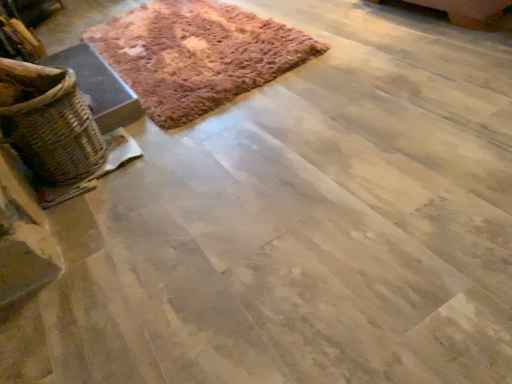
Question: Is the depth of woven brown basket at left less than that of brown textured rug at upper left?

Choices:
 (A) yes
 (B) no

Answer: (A)

Question: Is woven brown basket at left oriented away from brown textured rug at upper left?

Choices:
 (A) yes
 (B) no

Answer: (B)

Question: Considering the relative sizes of woven brown basket at left and brown textured rug at upper left in the image provided, is woven brown basket at left bigger than brown textured rug at upper left?

Choices:
 (A) yes
 (B) no

Answer: (B)

Question: Can you confirm if woven brown basket at left is positioned to the right of brown textured rug at upper left?

Choices:
 (A) yes
 (B) no

Answer: (B)

Question: Considering the relative sizes of woven brown basket at left and brown textured rug at upper left in the image provided, is woven brown basket at left taller than brown textured rug at upper left?

Choices:
 (A) no
 (B) yes

Answer: (B)

Question: Is woven brown basket at left not inside brown textured rug at upper left?

Choices:
 (A) yes
 (B) no

Answer: (A)

Question: Considering the relative sizes of brown textured rug at upper left and woven brown basket at left in the image provided, is brown textured rug at upper left wider than woven brown basket at left?

Choices:
 (A) yes
 (B) no

Answer: (A)

Question: Is the depth of brown textured rug at upper left greater than that of woven brown basket at left?

Choices:
 (A) yes
 (B) no

Answer: (A)

Question: Is woven brown basket at left a part of brown textured rug at upper left?

Choices:
 (A) yes
 (B) no

Answer: (B)

Question: Does brown textured rug at upper left appear on the left side of woven brown basket at left?

Choices:
 (A) yes
 (B) no

Answer: (B)

Question: From a real-world perspective, is brown textured rug at upper left physically below woven brown basket at left?

Choices:
 (A) yes
 (B) no

Answer: (A)

Question: Is brown textured rug at upper left touching woven brown basket at left?

Choices:
 (A) no
 (B) yes

Answer: (A)

Question: From a real-world perspective, is brown textured rug at upper left positioned above or below woven brown basket at left?

Choices:
 (A) below
 (B) above

Answer: (A)